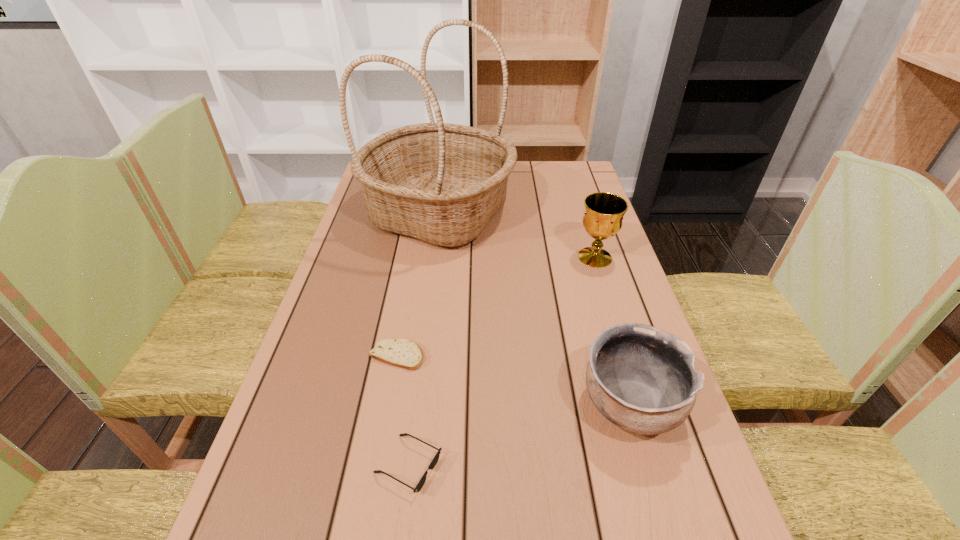
The width and height of the screenshot is (960, 540). Identify the location of empty space that is in between the third shortest object and the sunglasses. (519, 435).

Locate an element on the screen. Image resolution: width=960 pixels, height=540 pixels. empty space between the shortest object and the fourth tallest object is located at coordinates (403, 410).

Where is `vacant space that is in between the pita bread and the pottery`? The image size is (960, 540). vacant space that is in between the pita bread and the pottery is located at coordinates click(x=514, y=380).

Locate an element on the screen. This screenshot has height=540, width=960. object that is the closest one to the sunglasses is located at coordinates (403, 353).

Point out which object is positioned as the third nearest to the third tallest object. Please provide its 2D coordinates. Your answer should be formatted as a tuple, i.e. [(x, y)], where the tuple contains the x and y coordinates of a point satisfying the conditions above.

[(403, 353)]